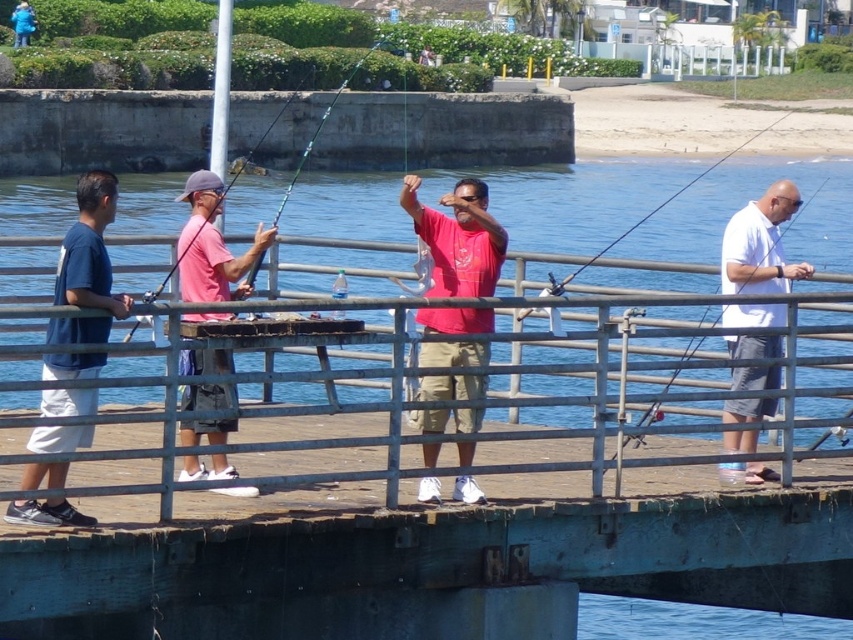
Question: Which of the following is the closest to the observer?

Choices:
 (A) (688, 276)
 (B) (306, 147)
 (C) (769, 317)
 (D) (267, 129)

Answer: (C)

Question: Can you confirm if dark blue t-shirt at left is positioned below blue fabric jacket at upper left?

Choices:
 (A) yes
 (B) no

Answer: (A)

Question: Does dark blue t-shirt at left appear under pink fabric shirt at center?

Choices:
 (A) no
 (B) yes

Answer: (B)

Question: Is blue water at center below matte white fishing pole at right?

Choices:
 (A) no
 (B) yes

Answer: (A)

Question: Which point is closer to the camera?

Choices:
 (A) teal glossy fishing pole at center
 (B) blue fabric jacket at upper left

Answer: (A)

Question: Which point is closer to the camera?

Choices:
 (A) (22, 45)
 (B) (71, 177)
 (C) (279, 209)
 (D) (247, 266)

Answer: (D)